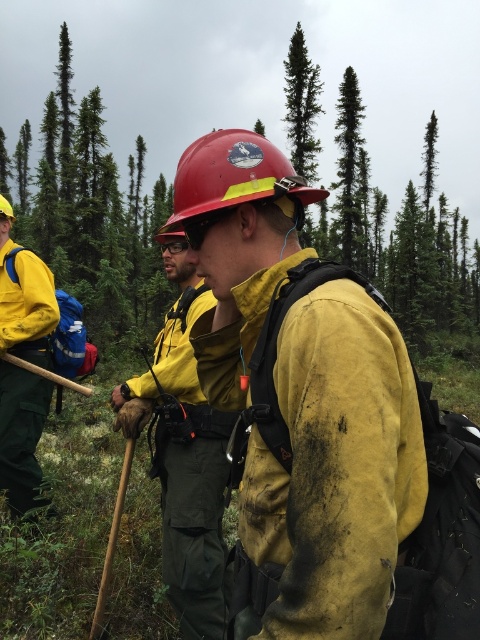
Question: Among these points, which one is nearest to the camera?

Choices:
 (A) (54, 141)
 (B) (278, 394)

Answer: (B)

Question: Is matte yellow jacket at center positioned before matte yellow helmet at center?

Choices:
 (A) no
 (B) yes

Answer: (B)

Question: Which of the following is the closest to the observer?

Choices:
 (A) (211, 632)
 (B) (6, 209)

Answer: (A)

Question: From the image, what is the correct spatial relationship of matte yellow jacket at center in relation to matte red hard hat at center?

Choices:
 (A) above
 (B) below

Answer: (B)

Question: Which of the following is the closest to the observer?

Choices:
 (A) (86, 186)
 (B) (223, 138)
 (C) (340, 216)

Answer: (B)

Question: Can you confirm if green leafy tree at upper left is thinner than yellow matte uniform at center?

Choices:
 (A) yes
 (B) no

Answer: (B)